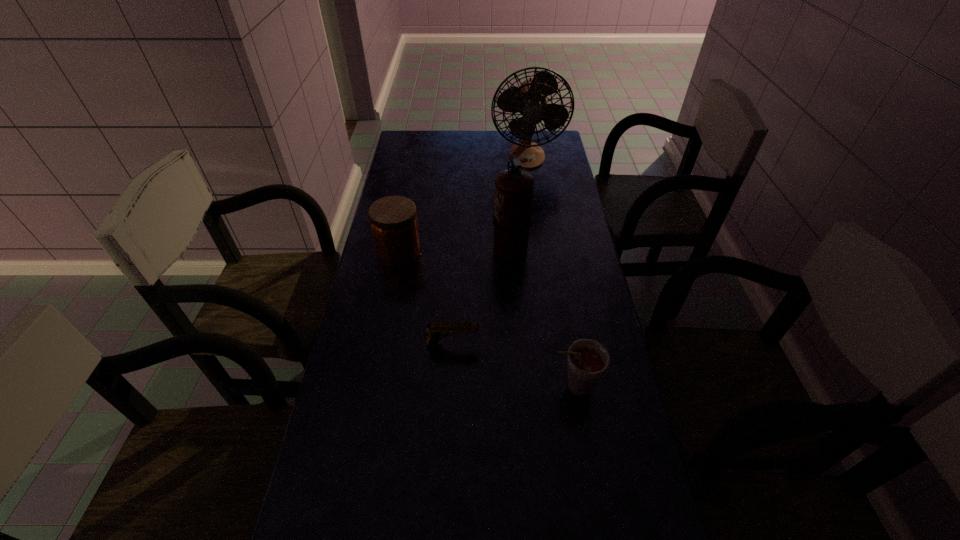
Find the location of `vacant space that is in between the jar and the root beer`. vacant space that is in between the jar and the root beer is located at coordinates (487, 319).

This screenshot has height=540, width=960. In order to click on vacant space that's between the root beer and the fan in this screenshot , I will do [x=550, y=271].

This screenshot has width=960, height=540. I want to click on the closest object to the leftmost object, so (x=512, y=218).

Identify the location of object that is the third closest to the nearest object. The image size is (960, 540). (393, 220).

What are the coordinates of `free spot that satisfies the following two spatial constraints: 1. in front of the fan to direct airflow; 2. at the barrel of the pistol` in the screenshot? It's located at (553, 344).

In order to click on blank space that satisfies the following two spatial constraints: 1. in front of the farthest object to direct airflow; 2. toward the nozzle of the fire extinguisher in this screenshot , I will do `click(540, 247)`.

You are a GUI agent. You are given a task and a screenshot of the screen. Output one action in this format:
    pyautogui.click(x=<x>, y=<y>)
    Task: Click on the vacant point that satisfies the following two spatial constraints: 1. in front of the fan to direct airflow; 2. toward the nozzle of the fire extinguisher
    
    Given the screenshot: What is the action you would take?
    pyautogui.click(x=540, y=247)